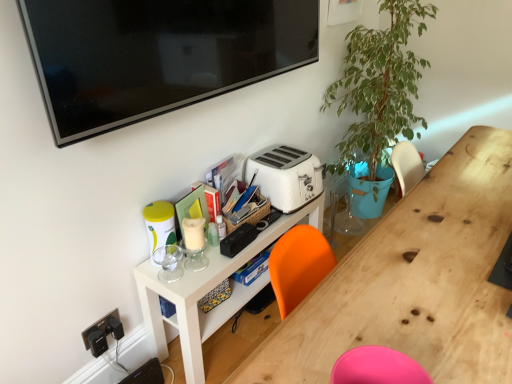
In order to face white plastic toaster at center, should I rotate leftwards or rightwards?

Turn right approximately 3.861 degrees to face it.

This screenshot has width=512, height=384. What do you see at coordinates (379, 84) in the screenshot?
I see `green leafy plant at upper right` at bounding box center [379, 84].

What do you see at coordinates (414, 281) in the screenshot? I see `wooden desk at center` at bounding box center [414, 281].

Where is `white matte shelf at center`? This screenshot has width=512, height=384. white matte shelf at center is located at coordinates (207, 292).

Where is `white plastic toaster at center`? The height and width of the screenshot is (384, 512). white plastic toaster at center is located at coordinates (286, 176).

Is green leafy plant at upper right at the back of white matte shelf at center?

white matte shelf at center is not turned away from green leafy plant at upper right.

Is white matte shelf at center bigger or smaller than green leafy plant at upper right?

In the image, white matte shelf at center appears to be smaller than green leafy plant at upper right.

Which of these two, white matte shelf at center or green leafy plant at upper right, stands shorter?

Standing shorter between the two is white matte shelf at center.

Is white matte shelf at center positioned far away from green leafy plant at upper right?

No, white matte shelf at center is not far away from green leafy plant at upper right.

Can you confirm if green leafy plant at upper right is bigger than white matte shelf at center?

Correct, green leafy plant at upper right is larger in size than white matte shelf at center.

Is green leafy plant at upper right in front of or behind white matte shelf at center in the image?

Visually, green leafy plant at upper right is located behind white matte shelf at center.

Can you confirm if green leafy plant at upper right is shorter than white matte shelf at center?

Incorrect, the height of green leafy plant at upper right does not fall short of that of white matte shelf at center.

Consider the image. Is wooden desk at center in front of or behind green leafy plant at upper right in the image?

Visually, wooden desk at center is located in front of green leafy plant at upper right.

Is wooden desk at center located outside green leafy plant at upper right?

Yes, wooden desk at center is outside of green leafy plant at upper right.

Between wooden desk at center and green leafy plant at upper right, which one has larger width?

green leafy plant at upper right.

Between white matte shelf at center and wooden desk at center, which one has smaller size?

Smaller between the two is white matte shelf at center.

How many degrees apart are the facing directions of white matte shelf at center and wooden desk at center?

1.07 degrees separate the facing orientations of white matte shelf at center and wooden desk at center.

Considering the sizes of white matte shelf at center and wooden desk at center in the image, is white matte shelf at center taller or shorter than wooden desk at center?

Considering their sizes, white matte shelf at center has less height than wooden desk at center.

Is white matte shelf at center next to wooden desk at center and touching it?

No, white matte shelf at center is not in contact with wooden desk at center.

Based on the photo, which object is wider, green leafy plant at upper right or wooden desk at center?

With larger width is green leafy plant at upper right.

Which of these two, green leafy plant at upper right or wooden desk at center, is smaller?

With smaller size is green leafy plant at upper right.

Which is nearer, (x=354, y=69) or (x=489, y=304)?

Point (x=354, y=69) appears to be farther away from the viewer than point (x=489, y=304).

Where is `desk in front of the green leafy plant at upper right`? The height and width of the screenshot is (384, 512). desk in front of the green leafy plant at upper right is located at coordinates (414, 281).

In the scene shown: How much distance is there between white plastic toaster at center and green leafy plant at upper right?

They are 24.24 inches apart.

From the image's perspective, does white plastic toaster at center appear lower than green leafy plant at upper right?

Yes, from the image's perspective, white plastic toaster at center is below green leafy plant at upper right.

From a real-world perspective, which is physically above, white plastic toaster at center or green leafy plant at upper right?

green leafy plant at upper right.

Is white plastic toaster at center further to camera compared to white matte shelf at center?

Yes, white plastic toaster at center is further from the camera.

From a real-world perspective, relative to white matte shelf at center, is white plastic toaster at center vertically above or below?

white plastic toaster at center is above white matte shelf at center.

Considering the relative positions of white plastic toaster at center and white matte shelf at center in the image provided, is white plastic toaster at center to the left of white matte shelf at center from the viewer's perspective?

No, white plastic toaster at center is not to the left of white matte shelf at center.

This screenshot has width=512, height=384. Identify the location of shelf on the left of green leafy plant at upper right. (207, 292).

This screenshot has height=384, width=512. What are the coordinates of `plant located on the right of white matte shelf at center` in the screenshot? It's located at (379, 84).

Estimate the real-world distances between objects in this image. Which object is closer to white plastic toaster at center, white matte shelf at center or wooden desk at center?

Among the two, white matte shelf at center is located nearer to white plastic toaster at center.

Considering their positions, is white matte shelf at center positioned closer to green leafy plant at upper right than wooden desk at center?

Among the two, white matte shelf at center is located nearer to green leafy plant at upper right.

Estimate the real-world distances between objects in this image. Which object is closer to white matte shelf at center, white plastic toaster at center or wooden desk at center?

white plastic toaster at center lies closer to white matte shelf at center than the other object.

When comparing their distances from white matte shelf at center, does white plastic toaster at center or green leafy plant at upper right seem closer?

Among the two, white plastic toaster at center is located nearer to white matte shelf at center.

When comparing their distances from wooden desk at center, does green leafy plant at upper right or white plastic toaster at center seem further?

green leafy plant at upper right.

Based on their spatial positions, is wooden desk at center or green leafy plant at upper right further from white matte shelf at center?

Based on the image, green leafy plant at upper right appears to be further to white matte shelf at center.

Based on their spatial positions, is green leafy plant at upper right or wooden desk at center further from white matte shelf at center?

Among the two, green leafy plant at upper right is located further to white matte shelf at center.

Estimate the real-world distances between objects in this image. Which object is closer to green leafy plant at upper right, white plastic toaster at center or wooden desk at center?

white plastic toaster at center is positioned closer to the anchor green leafy plant at upper right.

The height and width of the screenshot is (384, 512). I want to click on shelf located between wooden desk at center and white plastic toaster at center in the depth direction, so click(x=207, y=292).

The image size is (512, 384). In order to click on plant between wooden desk at center and white plastic toaster at center from front to back in this screenshot , I will do `click(379, 84)`.

Image resolution: width=512 pixels, height=384 pixels. Find the location of `toaster located between white matte shelf at center and green leafy plant at upper right in the left-right direction`. toaster located between white matte shelf at center and green leafy plant at upper right in the left-right direction is located at coordinates (286, 176).

Where is `shelf between wooden desk at center and green leafy plant at upper right in the front-back direction`? The height and width of the screenshot is (384, 512). shelf between wooden desk at center and green leafy plant at upper right in the front-back direction is located at coordinates (207, 292).